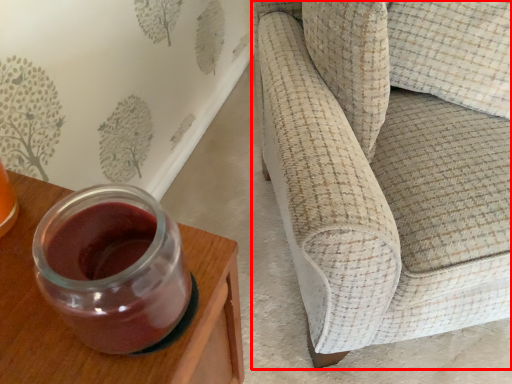
Question: From the image's perspective, where is studio couch (annotated by the red box) located in relation to furniture in the image?

Choices:
 (A) below
 (B) above

Answer: (B)